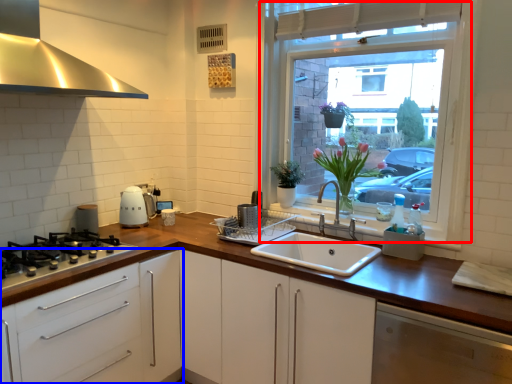
Question: Among these objects, which one is farthest to the camera, window (highlighted by a red box) or cabinetry (highlighted by a blue box)?

Choices:
 (A) window
 (B) cabinetry

Answer: (A)